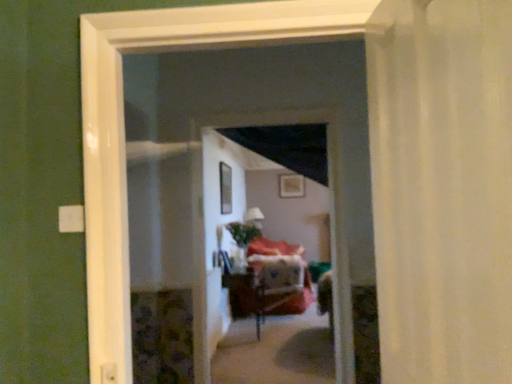
Question: Is transparent glass window at center surrounded by wooden table at center?

Choices:
 (A) no
 (B) yes

Answer: (A)

Question: Considering the relative positions of wooden table at center and transparent glass window at center in the image provided, is wooden table at center in front of transparent glass window at center?

Choices:
 (A) yes
 (B) no

Answer: (B)

Question: Considering the relative positions of wooden table at center and transparent glass window at center in the image provided, is wooden table at center to the right of transparent glass window at center from the viewer's perspective?

Choices:
 (A) yes
 (B) no

Answer: (A)

Question: Does wooden table at center turn towards transparent glass window at center?

Choices:
 (A) no
 (B) yes

Answer: (A)

Question: From the image's perspective, is wooden table at center beneath transparent glass window at center?

Choices:
 (A) yes
 (B) no

Answer: (A)

Question: Considering their positions, is wooden picture frame at upper center located in front of or behind wooden screen door at center?

Choices:
 (A) behind
 (B) front

Answer: (A)

Question: In terms of height, does wooden picture frame at upper center look taller or shorter compared to wooden screen door at center?

Choices:
 (A) tall
 (B) short

Answer: (B)

Question: Is wooden picture frame at upper center wider or thinner than wooden screen door at center?

Choices:
 (A) wide
 (B) thin

Answer: (B)

Question: In terms of size, does wooden picture frame at upper center appear bigger or smaller than wooden screen door at center?

Choices:
 (A) small
 (B) big

Answer: (A)

Question: From the image's perspective, is wooden picture frame at upper center located above or below transparent glass window at center?

Choices:
 (A) above
 (B) below

Answer: (A)

Question: Is wooden picture frame at upper center taller or shorter than transparent glass window at center?

Choices:
 (A) tall
 (B) short

Answer: (B)

Question: In the image, is wooden picture frame at upper center positioned in front of or behind transparent glass window at center?

Choices:
 (A) front
 (B) behind

Answer: (B)

Question: Based on their sizes in the image, would you say wooden picture frame at upper center is bigger or smaller than transparent glass window at center?

Choices:
 (A) small
 (B) big

Answer: (A)

Question: Do you think transparent glass window at center is within wooden picture frame at upper center, or outside of it?

Choices:
 (A) inside
 (B) outside

Answer: (B)

Question: Considering their positions, is transparent glass window at center located in front of or behind wooden picture frame at upper center?

Choices:
 (A) front
 (B) behind

Answer: (A)